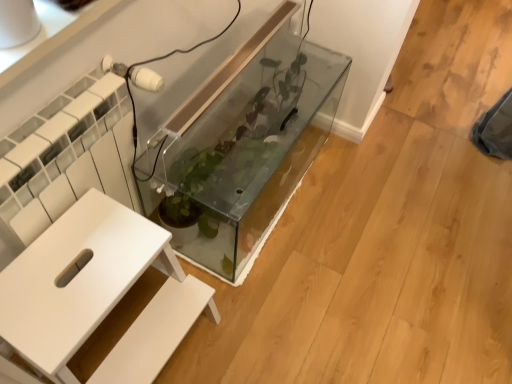
This screenshot has height=384, width=512. Describe the element at coordinates (97, 293) in the screenshot. I see `white matte table at center` at that location.

Describe the element at coordinates (68, 162) in the screenshot. I see `white textured radiator at left` at that location.

You are a GUI agent. You are given a task and a screenshot of the screen. Output one action in this format:
    pyautogui.click(x=<x>, y=<y>)
    Task: Click on the transparent glass tank at center
    The width and height of the screenshot is (512, 384).
    Given the screenshot: What is the action you would take?
    pyautogui.click(x=246, y=145)

Is transparent glass tank at center facing towards white matte table at center?

No, transparent glass tank at center is not facing towards white matte table at center.

Who is taller, transparent glass tank at center or white matte table at center?

white matte table at center.

Considering the relative positions of transparent glass tank at center and white matte table at center in the image provided, is transparent glass tank at center in front of white matte table at center?

No, transparent glass tank at center is further to the viewer.

Is white matte table at center surrounded by transparent glass tank at center?

Actually, white matte table at center is outside transparent glass tank at center.

Is point (276, 53) closer to camera compared to point (5, 154)?

No, (276, 53) is behind (5, 154).

Which of these two, transparent glass tank at center or white textured radiator at left, is wider?

→ Wider between the two is transparent glass tank at center.

Identify the location of radiator on the left of the transparent glass tank at center. The width and height of the screenshot is (512, 384). (68, 162).

From the image's perspective, would you say transparent glass tank at center is shown under white textured radiator at left?

Incorrect, from the image's perspective, transparent glass tank at center is higher than white textured radiator at left.

Would you say white textured radiator at left contains transparent glass tank at center?

No, transparent glass tank at center is not surrounded by white textured radiator at left.

Locate an element on the screen. glass box on the right of white textured radiator at left is located at coordinates (246, 145).

Between white textured radiator at left and transparent glass tank at center, which one has smaller size?

white textured radiator at left.

Is white textured radiator at left looking in the opposite direction of transparent glass tank at center?

No, white textured radiator at left is not facing the opposite direction of transparent glass tank at center.

Is point (76, 343) more distant than point (310, 77)?

That is False.

Is white matte table at center positioned with its back to transparent glass tank at center?

No, white matte table at center is not facing the opposite direction of transparent glass tank at center.

Which object is positioned more to the left, white matte table at center or transparent glass tank at center?

white matte table at center is more to the left.

Which is correct: white matte table at center is inside transparent glass tank at center, or outside of it?

The correct answer is: outside.

Is white textured radiator at left inside white matte table at center?

That's incorrect, white textured radiator at left is not inside white matte table at center.

From the image's perspective, is white matte table at center located beneath white textured radiator at left?

Yes, from the image's perspective, white matte table at center is beneath white textured radiator at left.

Is white matte table at center taller or shorter than white textured radiator at left?

Clearly, white matte table at center is shorter compared to white textured radiator at left.

Is white matte table at center turned away from white textured radiator at left?

Yes.

From a real-world perspective, between white textured radiator at left and white matte table at center, who is vertically lower?

In real-world perspective, white matte table at center is lower.

From the picture: Is white textured radiator at left directly adjacent to white matte table at center?

No, white textured radiator at left is not next to white matte table at center.

How distant is white textured radiator at left from white matte table at center?

17.94 centimeters.

Considering the sizes of white textured radiator at left and white matte table at center in the image, is white textured radiator at left taller or shorter than white matte table at center?

white textured radiator at left is taller than white matte table at center.

In order to click on glass box below the white matte table at center (from a real-world perspective) in this screenshot , I will do [246, 145].

Find the location of a particular element. The width and height of the screenshot is (512, 384). glass box on the right of white textured radiator at left is located at coordinates pyautogui.click(x=246, y=145).

Considering their positions, is white matte table at center positioned closer to transparent glass tank at center than white textured radiator at left?

white textured radiator at left is closer to transparent glass tank at center.

Estimate the real-world distances between objects in this image. Which object is further from white textured radiator at left, white matte table at center or transparent glass tank at center?

transparent glass tank at center.

Which object lies nearer to the anchor point transparent glass tank at center, white textured radiator at left or white matte table at center?

Based on the image, white textured radiator at left appears to be nearer to transparent glass tank at center.

Estimate the real-world distances between objects in this image. Which object is closer to white textured radiator at left, transparent glass tank at center or white matte table at center?

white matte table at center is positioned closer to the anchor white textured radiator at left.

Which object lies further to the anchor point white matte table at center, transparent glass tank at center or white textured radiator at left?

transparent glass tank at center.

Estimate the real-world distances between objects in this image. Which object is closer to white matte table at center, white textured radiator at left or transparent glass tank at center?

white textured radiator at left is positioned closer to the anchor white matte table at center.

Find the location of a particular element. This screenshot has height=384, width=512. radiator between transparent glass tank at center and white matte table at center in the up-down direction is located at coordinates (68, 162).